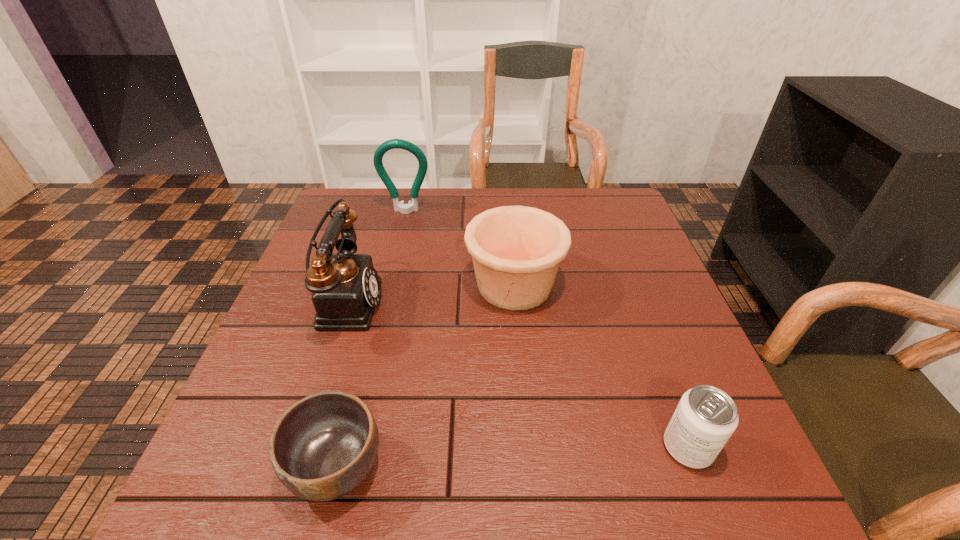
Where is `vacant space that satisfies the following two spatial constraints: 1. at the jaws of the pottery; 2. on the right side of the bottle opener`? This screenshot has height=540, width=960. vacant space that satisfies the following two spatial constraints: 1. at the jaws of the pottery; 2. on the right side of the bottle opener is located at coordinates (389, 285).

Find the location of a particular element. This screenshot has height=540, width=960. vacant area that satisfies the following two spatial constraints: 1. at the jaws of the farthest object; 2. on the front of the telephone at the rotary dial is located at coordinates (385, 301).

You are a GUI agent. You are given a task and a screenshot of the screen. Output one action in this format:
    pyautogui.click(x=<x>, y=<y>)
    Task: Click on the free spot that satisfies the following two spatial constraints: 1. at the jaws of the farthest object; 2. on the front of the telephone at the rotary dial
    This screenshot has width=960, height=540.
    Given the screenshot: What is the action you would take?
    pyautogui.click(x=385, y=301)

Identify the location of vacant space that satisfies the following two spatial constraints: 1. on the front of the telephone at the rotary dial; 2. on the right side of the rightmost object. (296, 448).

This screenshot has width=960, height=540. Identify the location of vacant space that satisfies the following two spatial constraints: 1. at the jaws of the farthest object; 2. on the front of the telephone at the rotary dial. (385, 301).